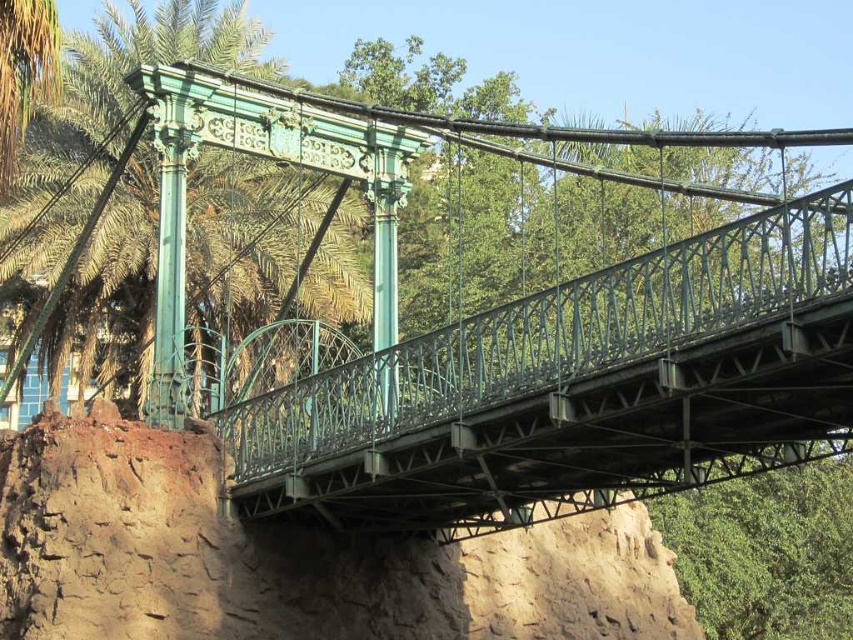
Question: Is brown rough cliff at lower center closer to the viewer compared to green metal palm tree at left?

Choices:
 (A) yes
 (B) no

Answer: (A)

Question: From the image, what is the correct spatial relationship of brown rough cliff at lower center in relation to green metal palm tree at left?

Choices:
 (A) left
 (B) right

Answer: (B)

Question: Which point is closer to the camera?

Choices:
 (A) green metal palm tree at left
 (B) brown rough cliff at lower center

Answer: (B)

Question: Which point is closer to the camera?

Choices:
 (A) (126, 612)
 (B) (354, 280)

Answer: (A)

Question: Considering the relative positions of brown rough cliff at lower center and green metal palm tree at left in the image provided, where is brown rough cliff at lower center located with respect to green metal palm tree at left?

Choices:
 (A) above
 (B) below

Answer: (B)